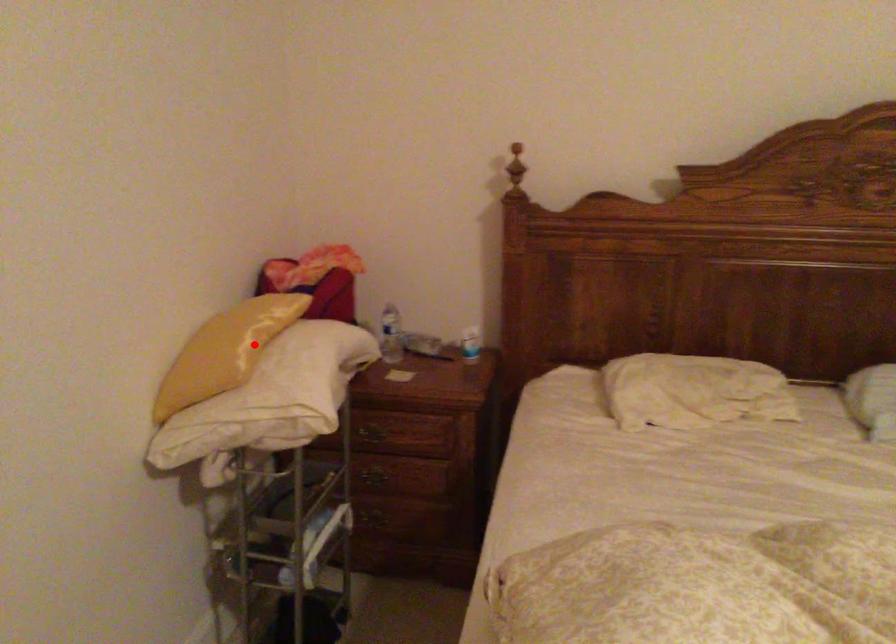
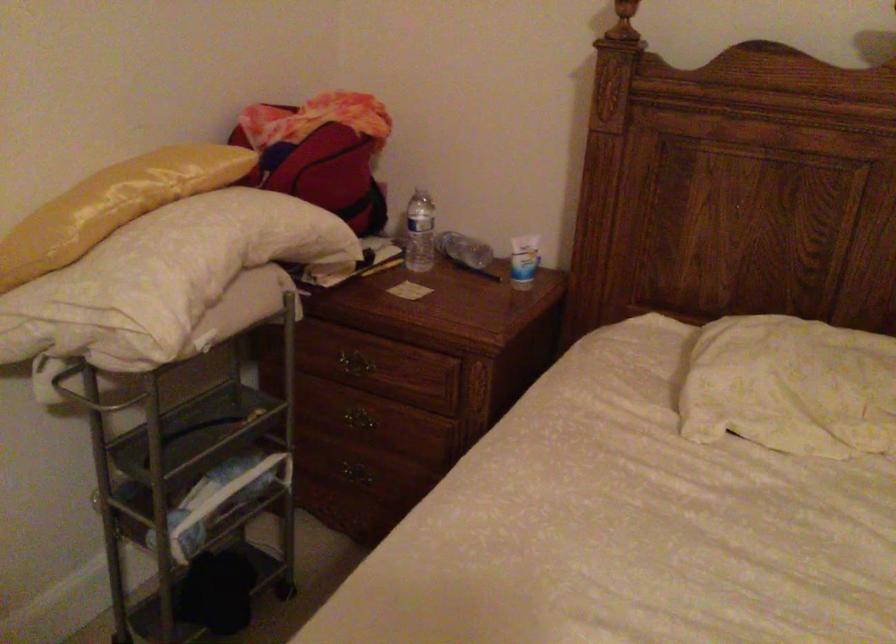
Question: I am providing you with two images of the same scene from different viewpoints. In image1, a red point is highlighted. Considering the same 3D point in image2, which of the following is correct?

Choices:
 (A) It is closer
 (B) It is farther

Answer: (A)